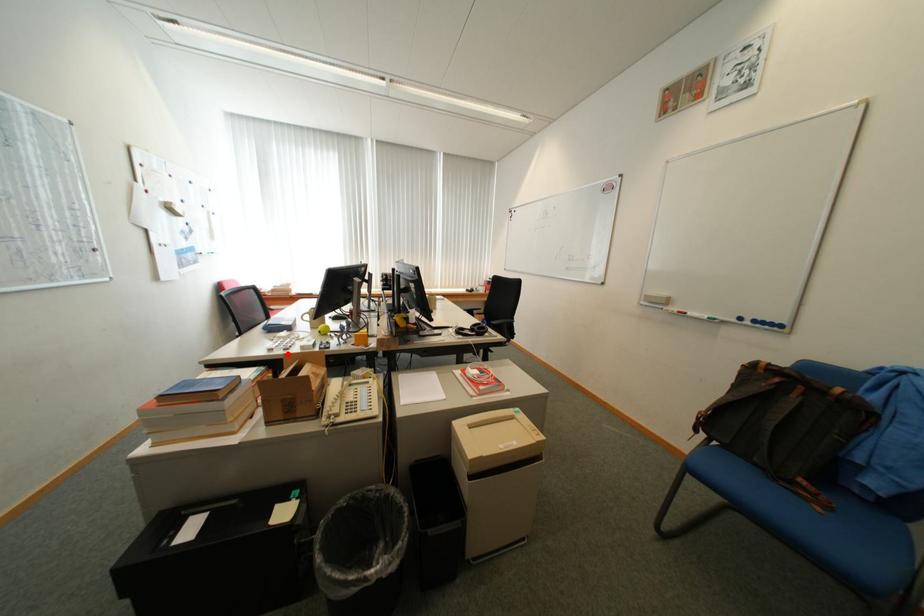
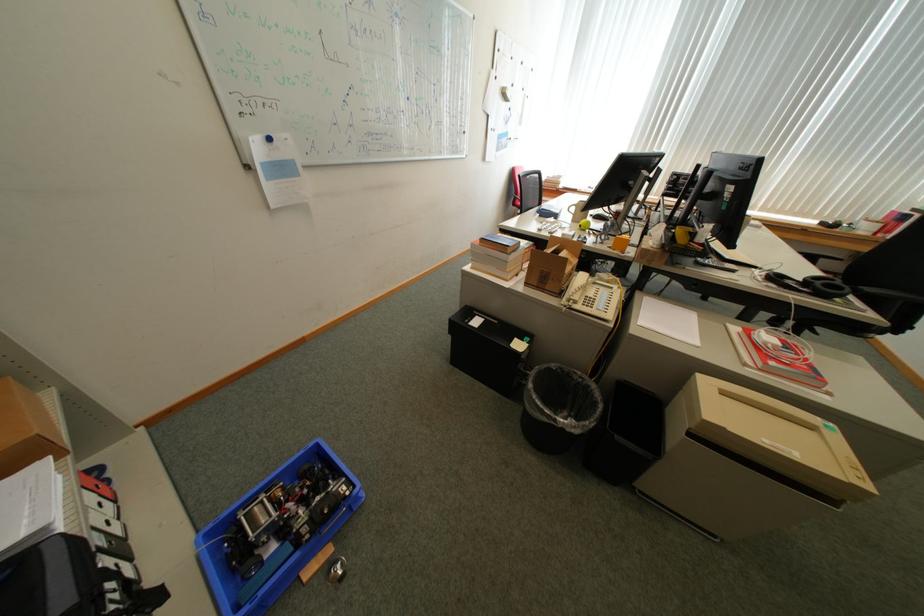
Where in the second image is the point corresponding to the highlighted location from the first image?

(553, 236)